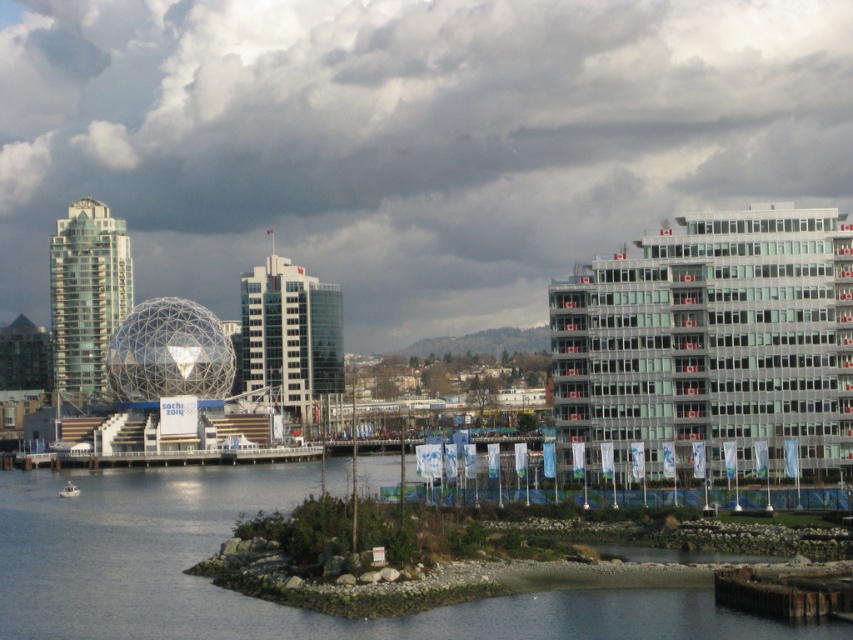
Can you confirm if blue water at lower left is positioned to the right of white plastic boat at lower left?

Yes, blue water at lower left is to the right of white plastic boat at lower left.

Can you confirm if blue water at lower left is positioned to the left of white plastic boat at lower left?

No, blue water at lower left is not to the left of white plastic boat at lower left.

Is point (297, 465) in front of point (74, 490)?

No, it is behind (74, 490).

This screenshot has height=640, width=853. I want to click on blue water at lower left, so click(257, 598).

Between point (22, 81) and point (65, 486), which one is positioned in front?

Point (65, 486) is in front.

Does white fluffy cloud at upper center appear on the right side of white plastic boat at lower left?

Yes, white fluffy cloud at upper center is to the right of white plastic boat at lower left.

Which is behind, point (724, 116) or point (68, 492)?

Point (724, 116)

You are a GUI agent. You are given a task and a screenshot of the screen. Output one action in this format:
    pyautogui.click(x=<x>, y=<y>)
    Task: Click on the white fluffy cloud at upper center
    
    Given the screenshot: What is the action you would take?
    pyautogui.click(x=405, y=140)

Which is more to the right, white fluffy cloud at upper center or blue water at lower left?

From the viewer's perspective, white fluffy cloud at upper center appears more on the right side.

Does white fluffy cloud at upper center appear over blue water at lower left?

Yes.

Which is behind, point (636, 212) or point (618, 611)?

Positioned behind is point (636, 212).

Where is `white fluffy cloud at upper center`? Image resolution: width=853 pixels, height=640 pixels. white fluffy cloud at upper center is located at coordinates (405, 140).